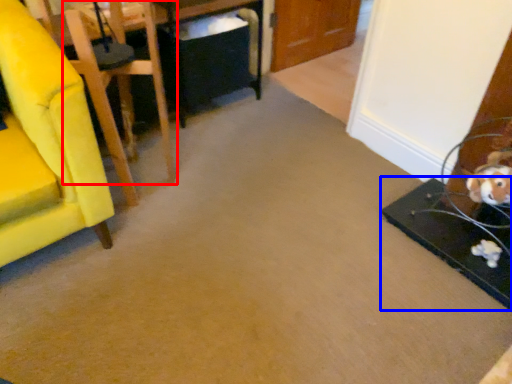
Question: Which object is further to the camera taking this photo, chair (highlighted by a red box) or table (highlighted by a blue box)?

Choices:
 (A) chair
 (B) table

Answer: (B)